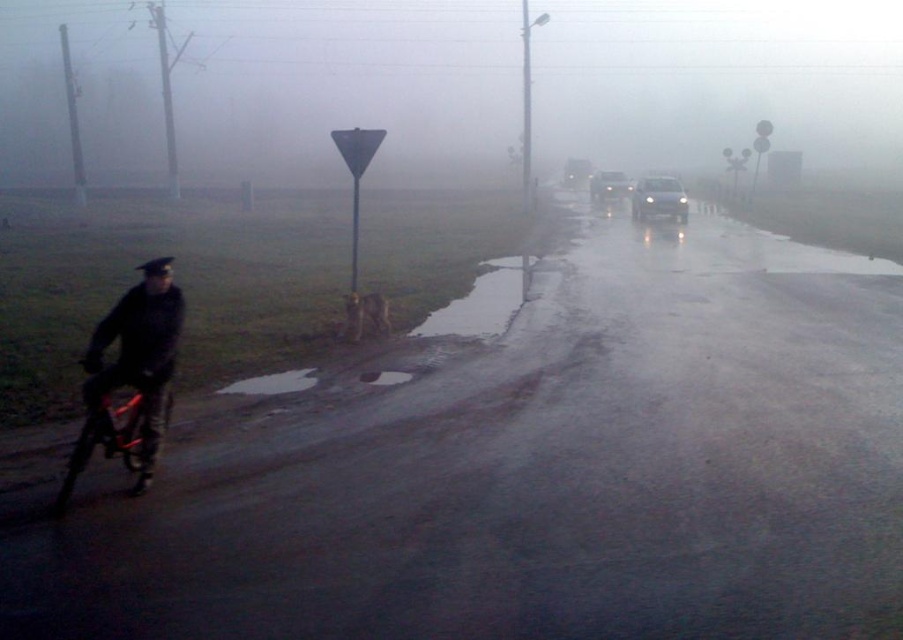
Locate an element on the screen. matte black jacket at left is located at coordinates pyautogui.click(x=138, y=353).

Looking at this image, between matte black jacket at left and white glossy sedan at center-right, which one is positioned lower?

matte black jacket at left

Which is behind, point (140, 468) or point (590, 193)?

The point (590, 193) is more distant.

Find the location of a particular element. The height and width of the screenshot is (640, 903). matte black jacket at left is located at coordinates (138, 353).

Can you confirm if shiny metallic bicycle at left is shorter than shiny silver sedan at center right?

Yes.

This screenshot has width=903, height=640. I want to click on shiny metallic bicycle at left, so click(119, 435).

Is point (133, 385) positioned in front of point (673, 182)?

Yes.

Find the location of `shiny metallic bicycle at left`. shiny metallic bicycle at left is located at coordinates (119, 435).

Who is more forward, (643, 202) or (610, 193)?

Point (643, 202) is in front.

Is point (666, 182) positioned after point (620, 196)?

No, it is not.

Between point (648, 212) and point (602, 179), which one is positioned in front?

Point (648, 212)

This screenshot has height=640, width=903. I want to click on shiny silver sedan at center right, so click(659, 198).